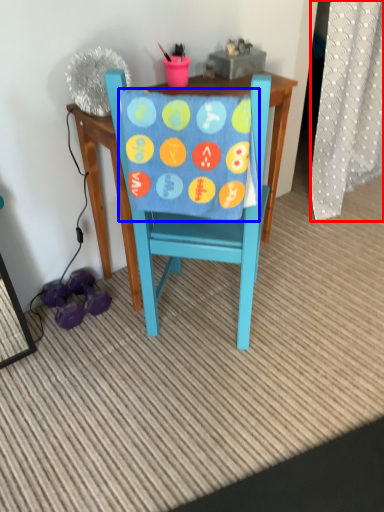
Question: Among these objects, which one is nearest to the camera, curtain (highlighted by a red box) or blanket (highlighted by a blue box)?

Choices:
 (A) curtain
 (B) blanket

Answer: (B)